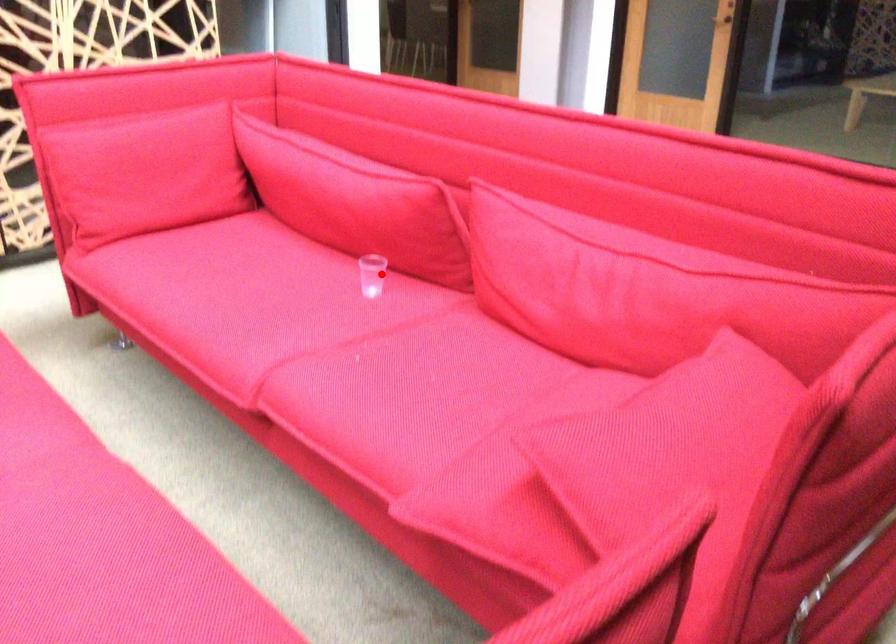
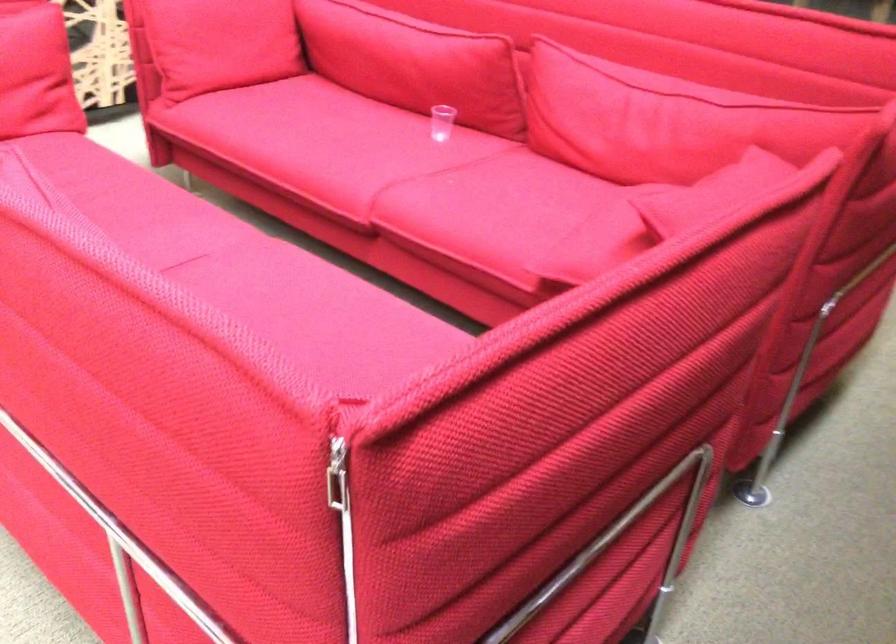
Question: A red point is marked in image1. In image2, is the corresponding 3D point closer to the camera or farther? Reply with the corresponding letter.

Choices:
 (A) The corresponding 3D point is closer.
 (B) The corresponding 3D point is farther.

Answer: (B)